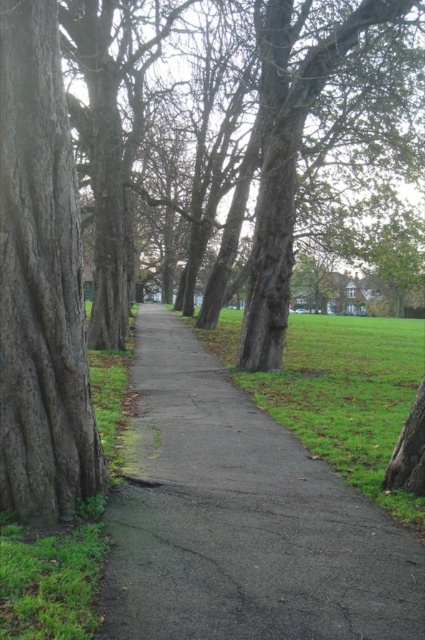
Question: Does dark brown textured bark at left have a larger size compared to green grass at center?

Choices:
 (A) no
 (B) yes

Answer: (A)

Question: Does gray asphalt path at center appear on the left side of green grass at center?

Choices:
 (A) no
 (B) yes

Answer: (B)

Question: Which of the following is the closest to the observer?

Choices:
 (A) (271, 545)
 (B) (295, 365)

Answer: (A)

Question: Which object appears farthest from the camera in this image?

Choices:
 (A) gray asphalt path at center
 (B) green grass at center

Answer: (B)

Question: Where is gray asphalt path at center located in relation to green grass at center in the image?

Choices:
 (A) left
 (B) right

Answer: (A)

Question: Which object is positioned closest to the green grass at center?

Choices:
 (A) dark brown textured bark at left
 (B) gray asphalt path at center

Answer: (B)